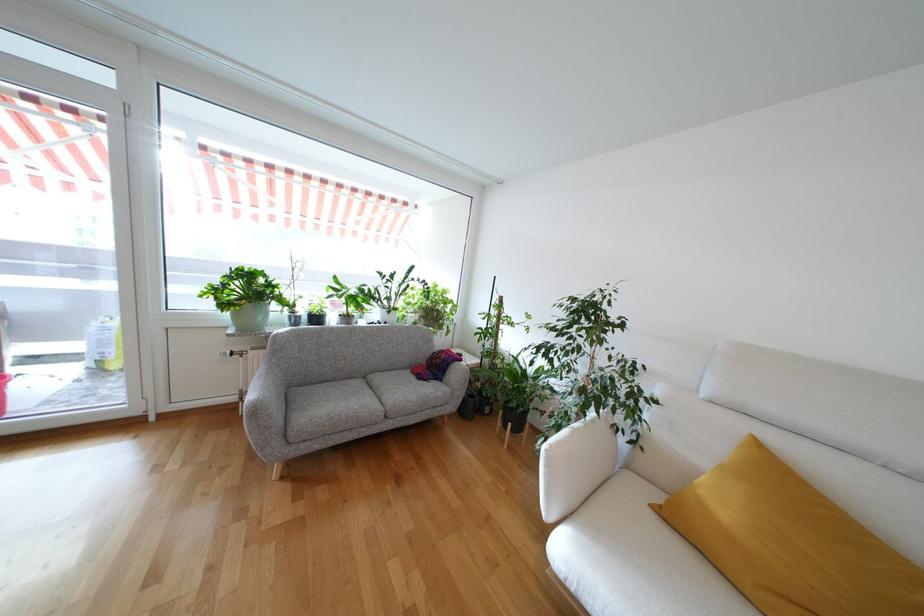
This screenshot has height=616, width=924. Find the location of `yellow pillow`. yellow pillow is located at coordinates (789, 541).